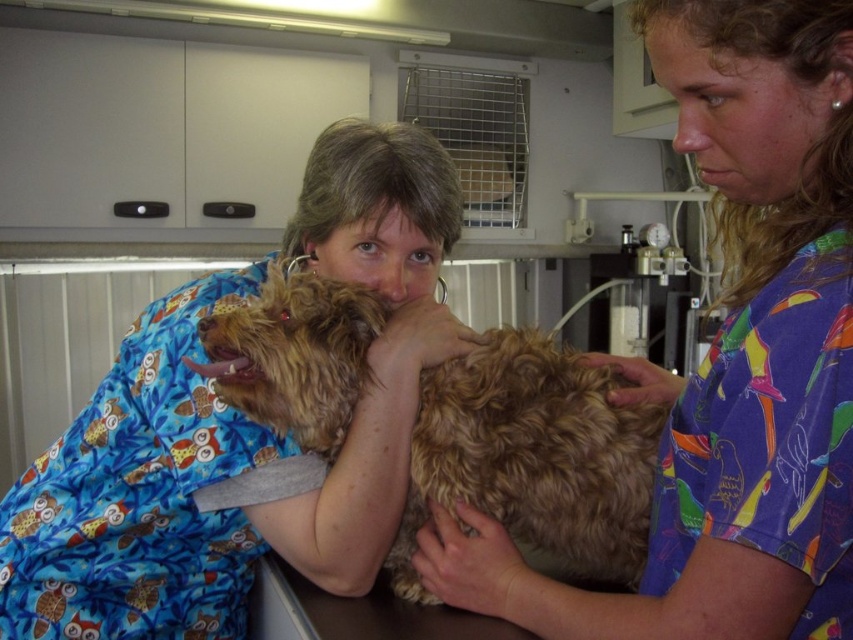
Question: Among these objects, which one is nearest to the camera?

Choices:
 (A) fuzzy brown dog at center
 (B) blue printed scrubs at center

Answer: (A)

Question: Is blue printed scrubs at center wider than fuzzy brown dog at center?

Choices:
 (A) yes
 (B) no

Answer: (A)

Question: Does blue printed scrubs at center appear on the left side of fuzzy brown dog at center?

Choices:
 (A) no
 (B) yes

Answer: (B)

Question: Can you confirm if blue printed scrubs at center is positioned to the right of fuzzy brown dog at center?

Choices:
 (A) no
 (B) yes

Answer: (A)

Question: Which point is closer to the camera?

Choices:
 (A) (422, 148)
 (B) (567, 547)

Answer: (B)